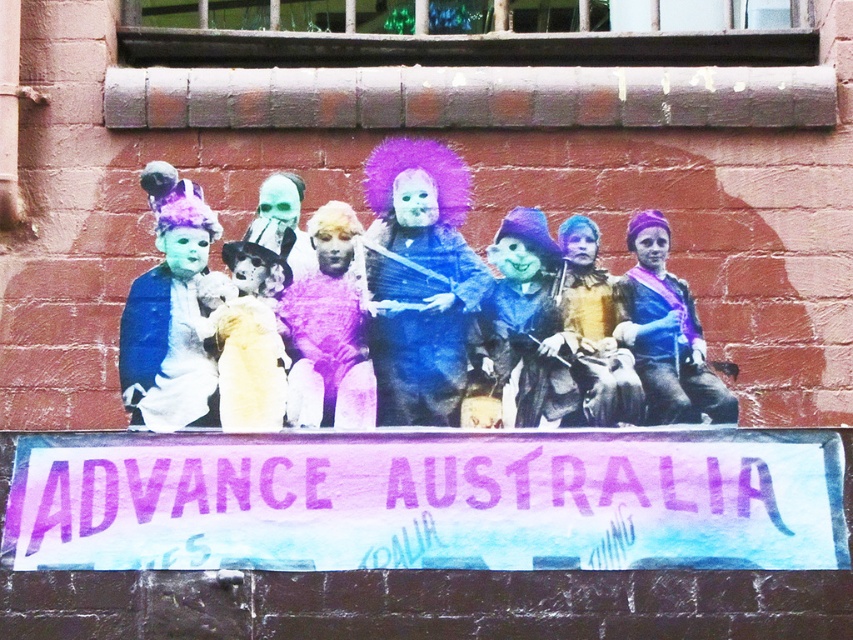
You are standing 20 meters away from the point at coordinates (x=28, y=548). Can you reach the point without moving closer than 15 meters?

The point at coordinates (x=28, y=548) is 15.82 meters away from the viewer. Since you are currently 20 meters away, you can move closer to reach the point without going beyond the 15 meters minimum distance requirement.

You are an event organizer who needs to place a new decorative item between the fuzzy blue doll at center and the matte blue fabric at center. Based on their heights, which object should the new item be placed closer to?

The fuzzy blue doll at center is taller than the matte blue fabric at center, so the new decorative item should be placed closer to the matte blue fabric at center to maintain visual balance.

You are an event planner assessing the layout of this performance area. The watercolor painted banner at bottom and the purple fuzzy sweater at center are both part of the decor. Based on their sizes, which one might require more vertical space to display properly?

The purple fuzzy sweater at center requires more vertical space because the watercolor painted banner at bottom has a lesser height compared to it.